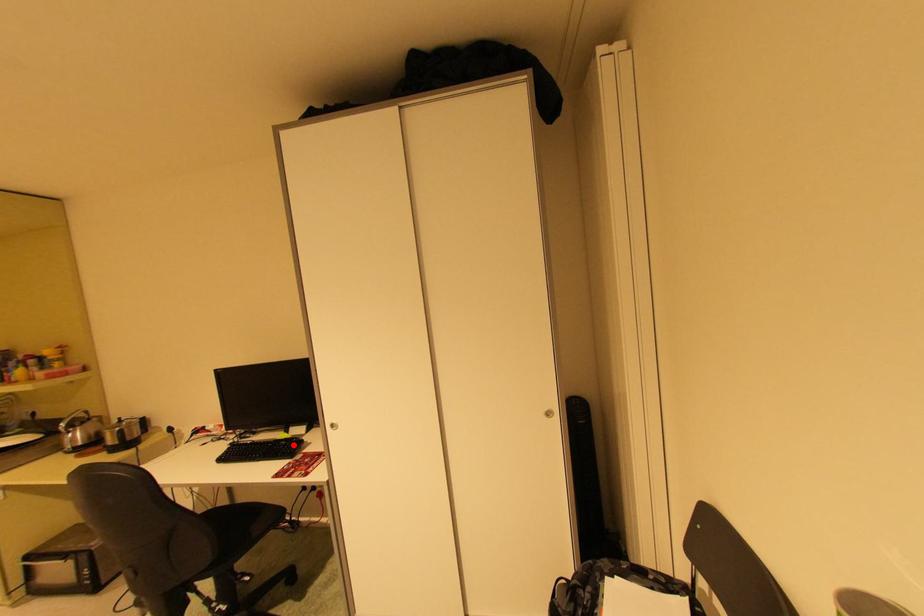
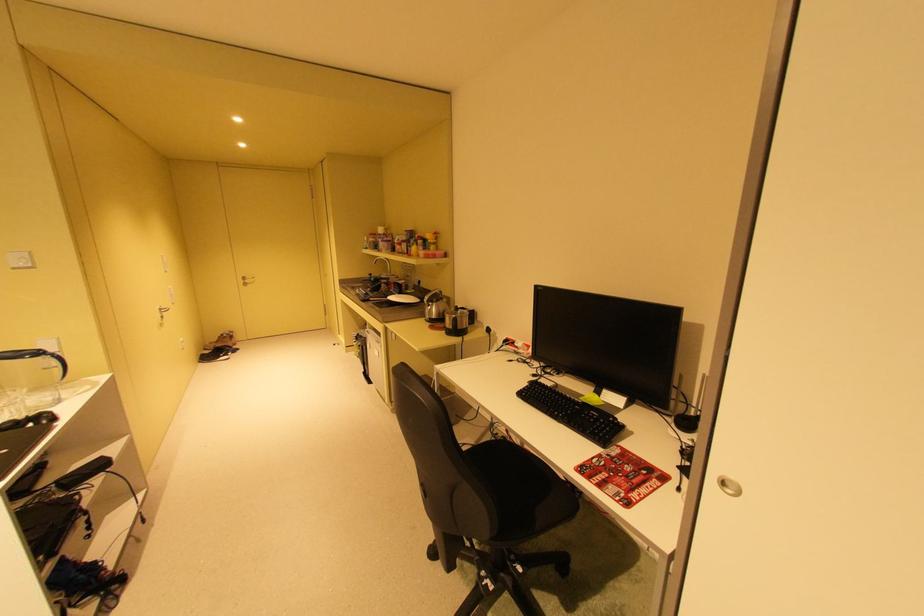
Find the pixel in the second image that matches the highlighted location in the first image.

(604, 419)